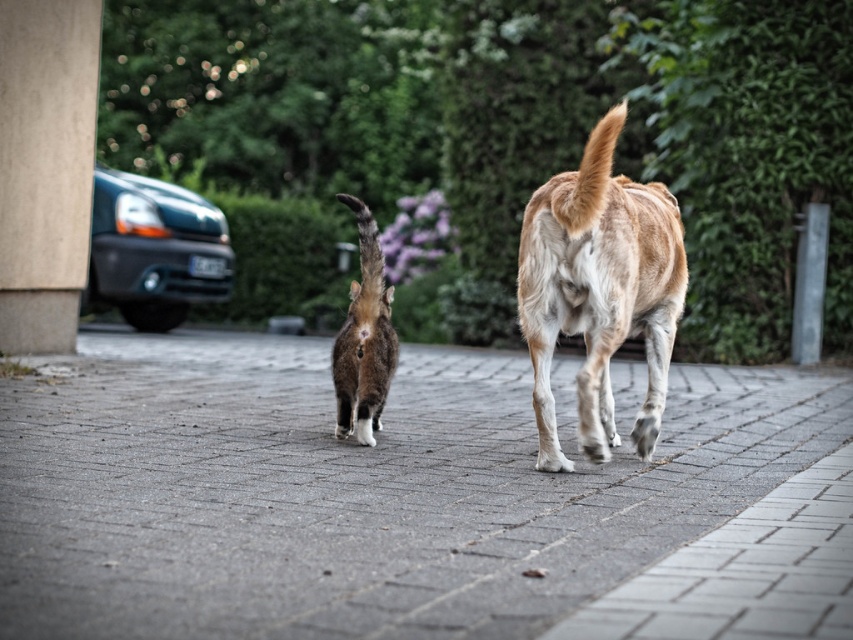
Question: Does light brown fur dog at center appear on the left side of soft fur cat at center?

Choices:
 (A) no
 (B) yes

Answer: (A)

Question: Estimate the real-world distances between objects in this image. Which object is farther from the light brown fur dog at center?

Choices:
 (A) gray concrete pavement at center
 (B) smooth concrete pillar at left
 (C) light brown fur tail at center

Answer: (B)

Question: Does light brown fur dog at center come behind matte black van at left?

Choices:
 (A) yes
 (B) no

Answer: (B)

Question: Is gray concrete pavement at center to the right of light brown fur tail at center from the viewer's perspective?

Choices:
 (A) no
 (B) yes

Answer: (A)

Question: Which object is the closest to the light brown fur dog at center?

Choices:
 (A) smooth concrete pillar at left
 (B) gray concrete pavement at center
 (C) soft fur cat at center

Answer: (C)

Question: Which object is positioned closest to the smooth concrete pillar at left?

Choices:
 (A) soft fur cat at center
 (B) light brown fur dog at center
 (C) light brown fur tail at center
 (D) gray concrete pavement at center

Answer: (D)